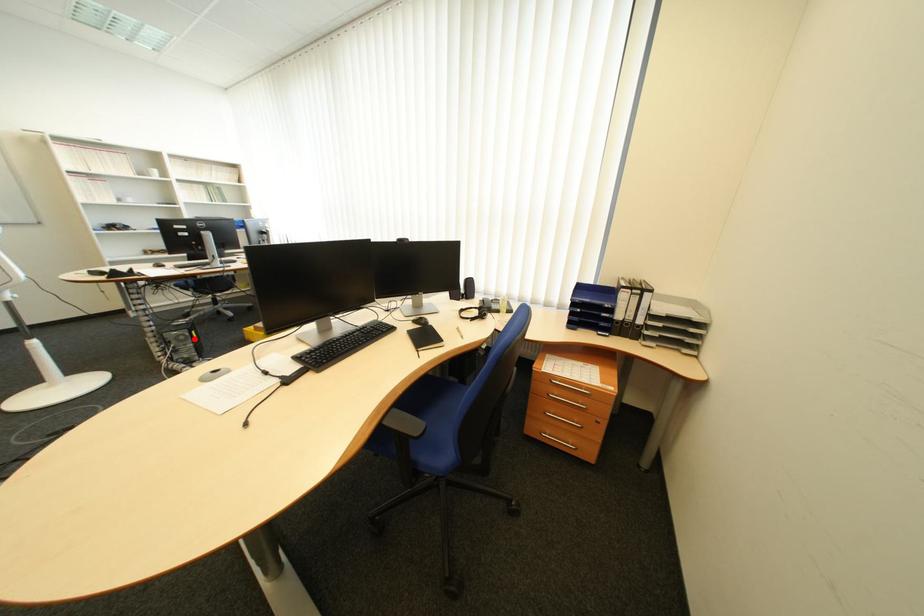
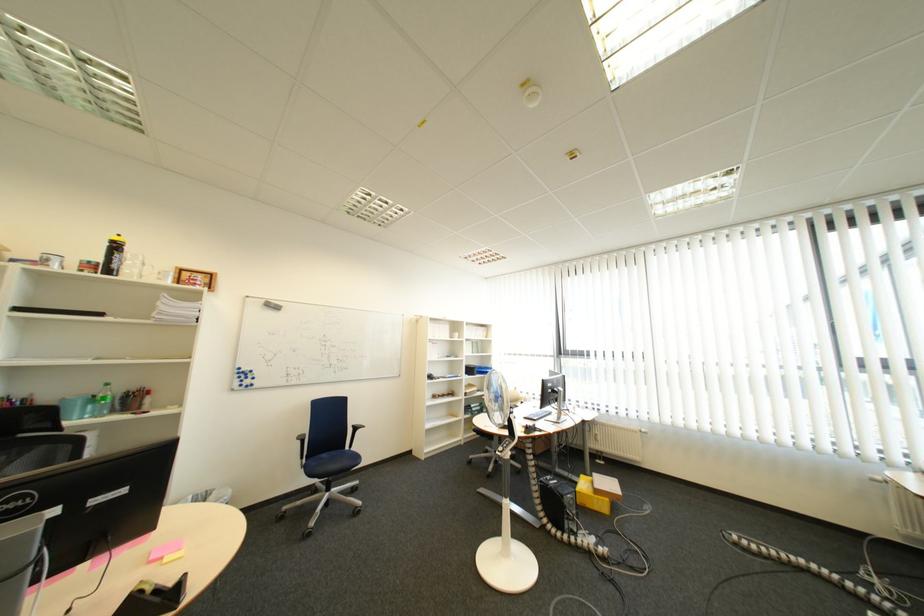
The point at the highlighted location is marked in the first image. Where is the corresponding point in the second image?

(585, 503)